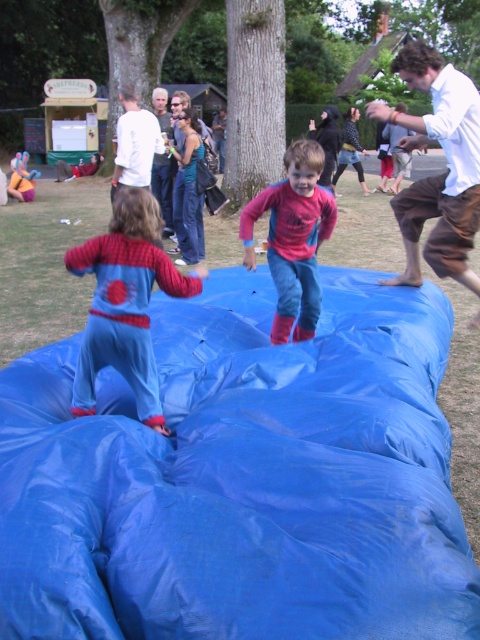
Consider the image. Does blue rubber mat at center have a lesser height compared to blue plush pajamas at center?

Correct, blue rubber mat at center is not as tall as blue plush pajamas at center.

Which of these two, blue rubber mat at center or blue plush pajamas at center, stands shorter?

With less height is blue rubber mat at center.

This screenshot has height=640, width=480. What do you see at coordinates (241, 477) in the screenshot?
I see `blue rubber mat at center` at bounding box center [241, 477].

Identify the location of blue rubber mat at center. (241, 477).

Can you confirm if blue rubber mat at center is positioned above red matte spider-man costume at center?

No.

You are a GUI agent. You are given a task and a screenshot of the screen. Output one action in this format:
    pyautogui.click(x=<x>, y=<y>)
    Task: Click on the blue rubber mat at center
    The width and height of the screenshot is (480, 640).
    Given the screenshot: What is the action you would take?
    pos(241,477)

Which is in front, point (389, 563) or point (291, 269)?

Point (389, 563)

This screenshot has height=640, width=480. What are the coordinates of `blue rubber mat at center` in the screenshot? It's located at (241, 477).

The width and height of the screenshot is (480, 640). What do you see at coordinates (126, 301) in the screenshot? I see `blue plush pajamas at center` at bounding box center [126, 301].

Which is more to the left, blue plush pajamas at center or red matte spider-man costume at center?

Positioned to the left is blue plush pajamas at center.

Where is `blue plush pajamas at center`? blue plush pajamas at center is located at coordinates (126, 301).